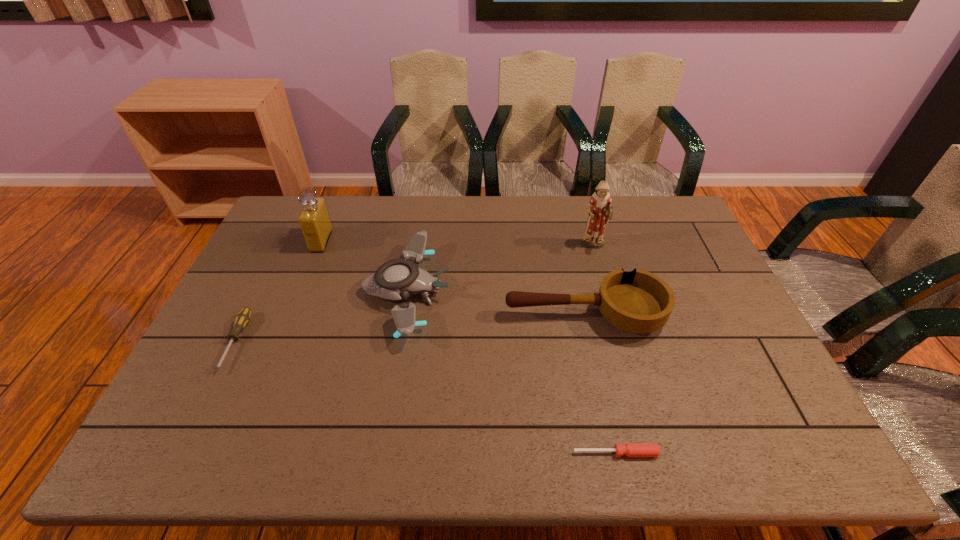
The image size is (960, 540). I want to click on free space that satisfies the following two spatial constraints: 1. on the front-facing side of the right screwdriver; 2. on the left side of the fifth object from right to left, so click(235, 453).

The height and width of the screenshot is (540, 960). Find the location of `free region that satisfies the following two spatial constraints: 1. on the front-facing side of the perfume; 2. at the tip of the fifth tallest object`. free region that satisfies the following two spatial constraints: 1. on the front-facing side of the perfume; 2. at the tip of the fifth tallest object is located at coordinates (280, 342).

The image size is (960, 540). In order to click on free space that satisfies the following two spatial constraints: 1. at the tip of the fifth tallest object; 2. on the right side of the right screwdriver in this screenshot , I will do `click(180, 453)`.

Find the location of a particular element. free space that satisfies the following two spatial constraints: 1. with the handle on the side of the saucepan; 2. on the front-facing side of the perfume is located at coordinates (567, 241).

Locate an element on the screen. Image resolution: width=960 pixels, height=540 pixels. vacant space that satisfies the following two spatial constraints: 1. with the handle on the side of the saucepan; 2. on the front-facing side of the drone is located at coordinates point(579,292).